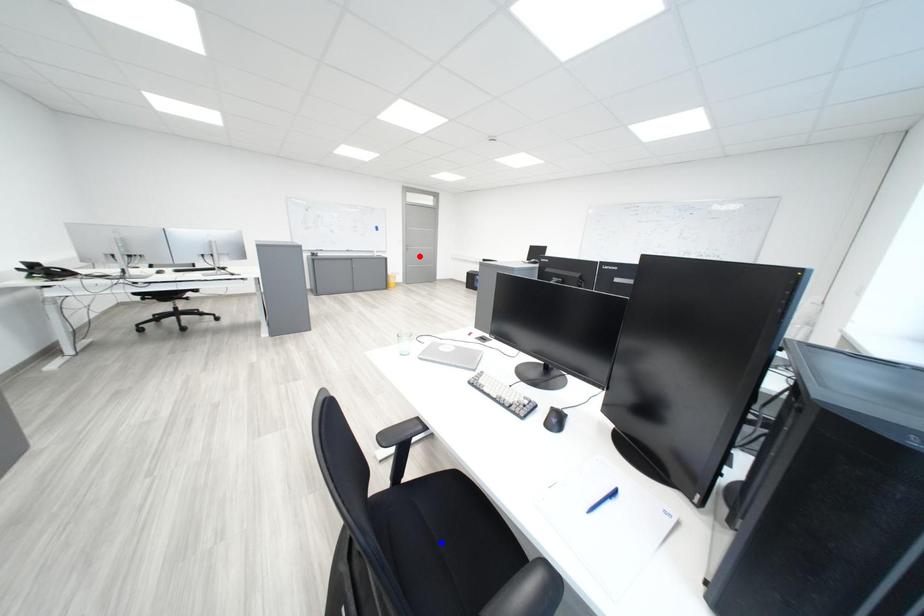
Question: In the image, two points are highlighted. Which point is nearer to the camera? Reply with the corresponding letter.

Choices:
 (A) blue point
 (B) red point

Answer: (A)